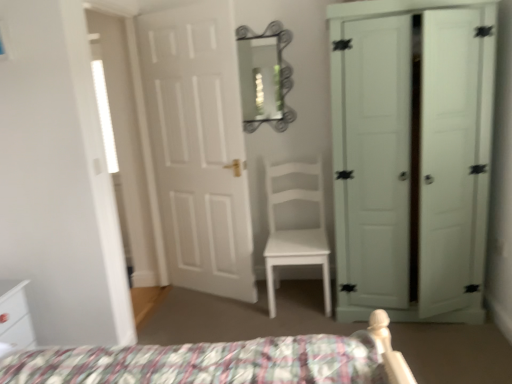
Image resolution: width=512 pixels, height=384 pixels. I want to click on free spot above white matte door at center, which is counted as the first door, starting from the left (from a real-world perspective), so click(x=178, y=6).